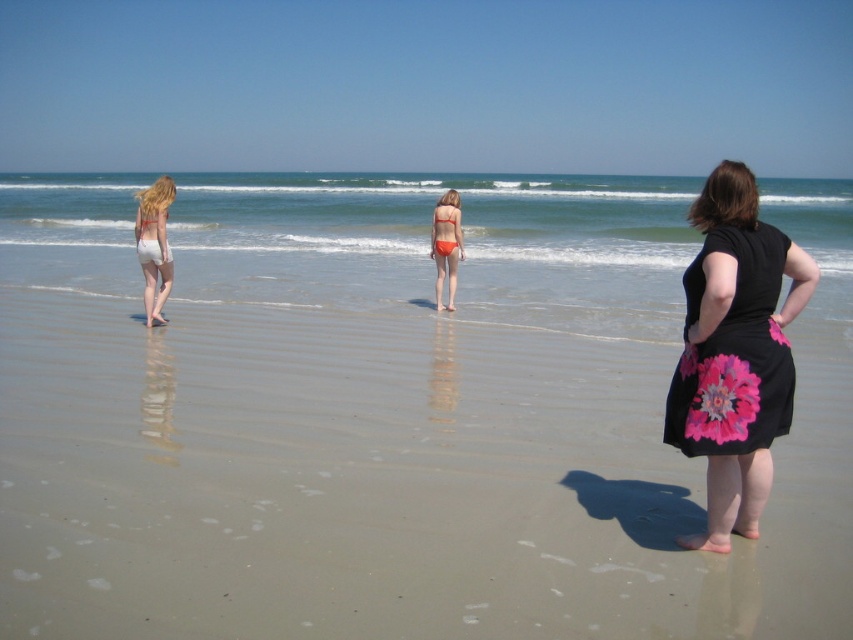
Who is more distant from viewer, (28, 202) or (158, 198)?

The point (28, 202) is behind.

Can you confirm if blue water at center is taller than white cotton shorts at left?

Yes.

Image resolution: width=853 pixels, height=640 pixels. Identify the location of blue water at center. (431, 212).

Locate an element on the screen. The image size is (853, 640). blue water at center is located at coordinates (431, 212).

Which is behind, point (413, 236) or point (756, 376)?

Positioned behind is point (413, 236).

Between blue water at center and black floral dress at right, which one is positioned higher?

blue water at center

The width and height of the screenshot is (853, 640). What do you see at coordinates (431, 212) in the screenshot? I see `blue water at center` at bounding box center [431, 212].

Where is `blue water at center`? This screenshot has height=640, width=853. blue water at center is located at coordinates (431, 212).

Between sandy beach at center and blue water at center, which one appears on the left side from the viewer's perspective?

Positioned to the left is blue water at center.

Which is above, sandy beach at center or blue water at center?

Positioned higher is blue water at center.

Identify the location of sandy beach at center. (381, 480).